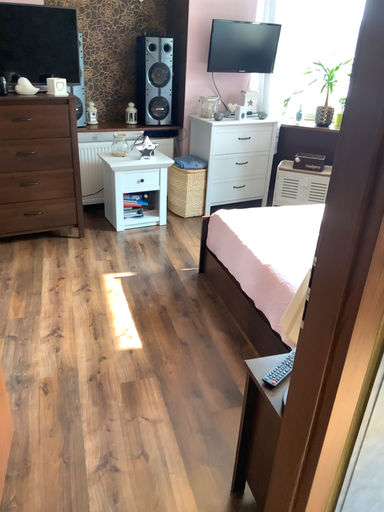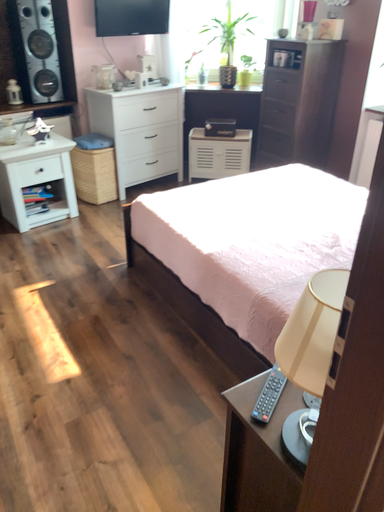
Question: How did the camera likely rotate when shooting the video?

Choices:
 (A) rotated left
 (B) rotated right

Answer: (B)